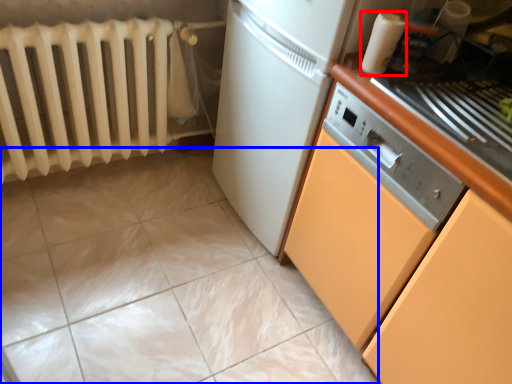
Question: Which of the following is the farthest to the observer, kitchen appliance (highlighted by a red box) or ceramic tile (highlighted by a blue box)?

Choices:
 (A) kitchen appliance
 (B) ceramic tile

Answer: (A)